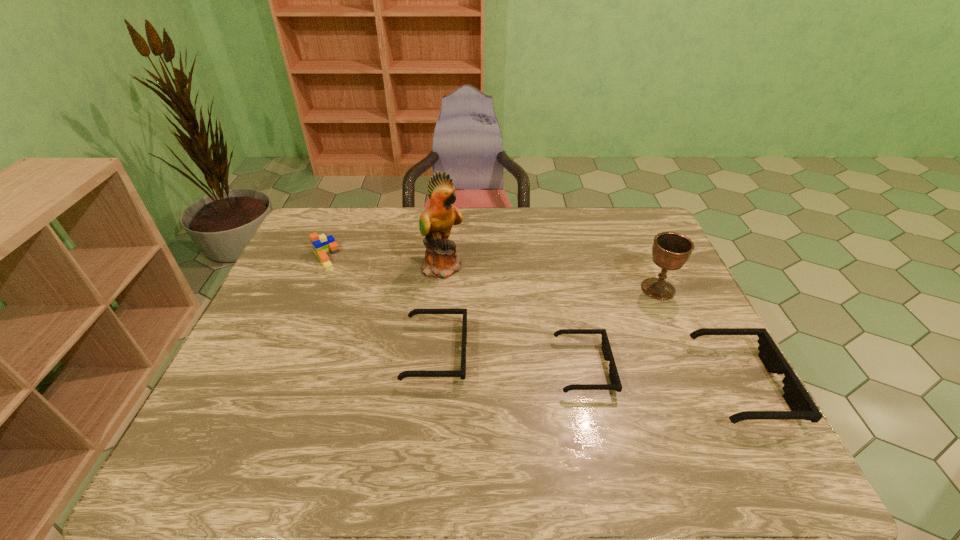
Locate an element on the screen. vacant area that lies between the third object from right to left and the rightmost sunglasses is located at coordinates (662, 376).

Locate an element on the screen. This screenshot has width=960, height=540. vacant region between the parrot and the leftmost object is located at coordinates (384, 261).

You are a GUI agent. You are given a task and a screenshot of the screen. Output one action in this format:
    pyautogui.click(x=<x>, y=<y>)
    Task: Click on the vacant area between the rightmost sunglasses and the second sunglasses from left to right
    The width and height of the screenshot is (960, 540).
    Given the screenshot: What is the action you would take?
    pyautogui.click(x=662, y=376)

Identify the location of unoccupied position between the rightmost sunglasses and the second tallest object. (700, 336).

Locate an element on the screen. object that ranks as the closest to the leftmost object is located at coordinates (436, 221).

Identify which object is the third nearest to the rightmost sunglasses. Please provide its 2D coordinates. Your answer should be formatted as a tuple, i.e. [(x, y)], where the tuple contains the x and y coordinates of a point satisfying the conditions above.

[(462, 374)]

Locate which sunglasses ranks in proximity to the tallest object. Please provide its 2D coordinates. Your answer should be formatted as a tuple, i.e. [(x, y)], where the tuple contains the x and y coordinates of a point satisfying the conditions above.

[(462, 374)]

Select which sunglasses appears as the closest to the chalice. Please provide its 2D coordinates. Your answer should be formatted as a tuple, i.e. [(x, y)], where the tuple contains the x and y coordinates of a point satisfying the conditions above.

[(802, 407)]

This screenshot has width=960, height=540. I want to click on vacant point that satisfies the following two spatial constraints: 1. on the front side of the fifth shortest object; 2. on the left side of the fourth shortest object, so click(x=311, y=289).

Find the location of `free spot that satisfies the following two spatial constraints: 1. on the front-facing side of the tallest object; 2. on the back side of the chalice`. free spot that satisfies the following two spatial constraints: 1. on the front-facing side of the tallest object; 2. on the back side of the chalice is located at coordinates (441, 289).